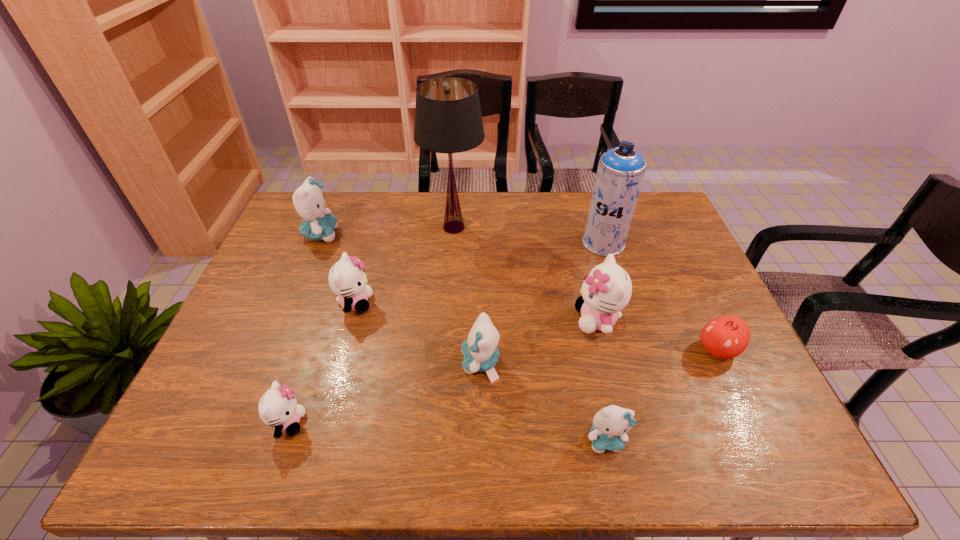
Where is `vacant space located on the face of the third kitten from right to left`? The image size is (960, 540). vacant space located on the face of the third kitten from right to left is located at coordinates (349, 363).

Locate an element on the screen. vacant space positioned on the face of the third kitten from right to left is located at coordinates (333, 363).

Identify the location of vacant space located 0.160m on the face of the third kitten from right to left. (397, 363).

Find the location of a particular element. The image size is (960, 540). free space located 0.310m on the front-facing side of the second biggest white kitten is located at coordinates (482, 303).

The height and width of the screenshot is (540, 960). Find the location of `free space located 0.360m on the back of the apple`. free space located 0.360m on the back of the apple is located at coordinates (668, 246).

The height and width of the screenshot is (540, 960). Find the location of `blank space located 0.290m on the front-facing side of the smallest white kitten`. blank space located 0.290m on the front-facing side of the smallest white kitten is located at coordinates (435, 423).

The image size is (960, 540). Identify the location of lampshade that is at the far edge. (448, 119).

Find the location of a particular element. This screenshot has height=540, width=960. aerosol can that is at the far edge is located at coordinates (620, 173).

Find the location of a particular element. The height and width of the screenshot is (540, 960). kitten at the far edge is located at coordinates (309, 202).

Locate an element on the screen. The height and width of the screenshot is (540, 960). object positioned at the left edge is located at coordinates (309, 202).